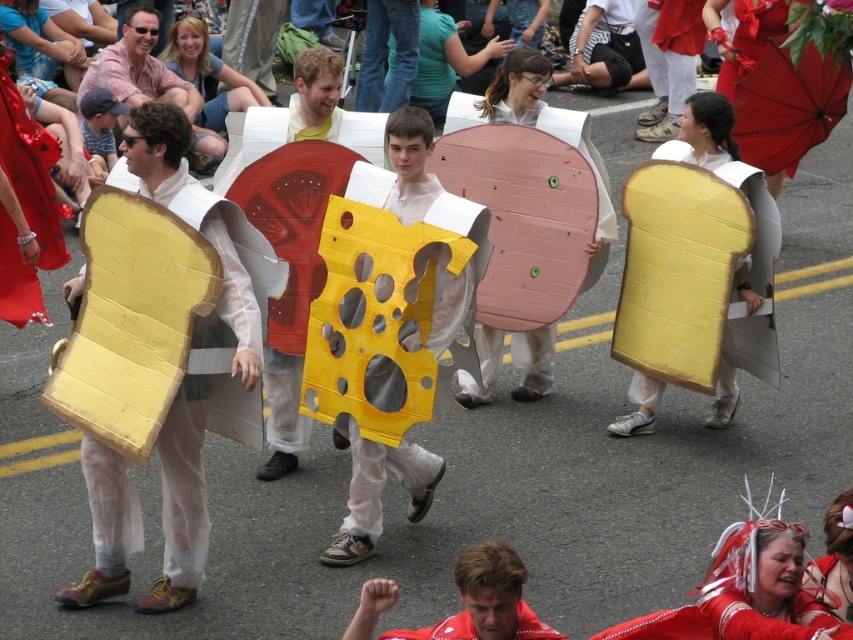
Question: Estimate the real-world distances between objects in this image. Which object is farther from the shiny red fabric at lower right?

Choices:
 (A) red fabric umbrella at upper right
 (B) matte red shirt at center
 (C) matte white cheese at center

Answer: (A)

Question: Is matte pink shirt at upper left to the left of matte white shirt at center from the viewer's perspective?

Choices:
 (A) yes
 (B) no

Answer: (A)

Question: Which point appears closest to the camera in this image?

Choices:
 (A) (115, 83)
 (B) (724, 161)

Answer: (B)

Question: Does red fabric umbrella at upper right have a larger size compared to matte white shirt at center?

Choices:
 (A) yes
 (B) no

Answer: (A)

Question: Can you confirm if matte white shirt at center is bigger than matte white cheese at center?

Choices:
 (A) no
 (B) yes

Answer: (B)

Question: Which of these objects is positioned closest to the matte yellow bread at left?

Choices:
 (A) matte pink shirt at upper left
 (B) matte white shirt at center
 (C) matte white cheese at center
 (D) matte red shirt at center

Answer: (D)